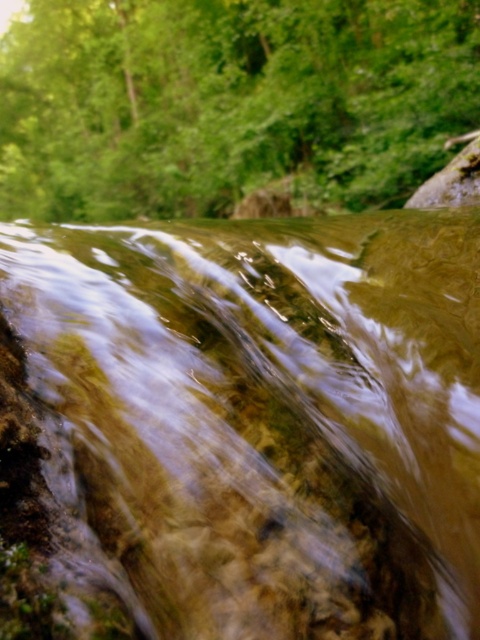
Question: Does clear water at center lie in front of green leafy tree at upper center?

Choices:
 (A) no
 (B) yes

Answer: (B)

Question: Which object appears closest to the camera in this image?

Choices:
 (A) clear water at center
 (B) green leafy tree at upper center

Answer: (A)

Question: Does clear water at center have a greater width compared to green leafy tree at upper center?

Choices:
 (A) no
 (B) yes

Answer: (A)

Question: Does clear water at center come behind green leafy tree at upper center?

Choices:
 (A) no
 (B) yes

Answer: (A)

Question: Which point is closer to the camera?

Choices:
 (A) clear water at center
 (B) green leafy tree at upper center

Answer: (A)